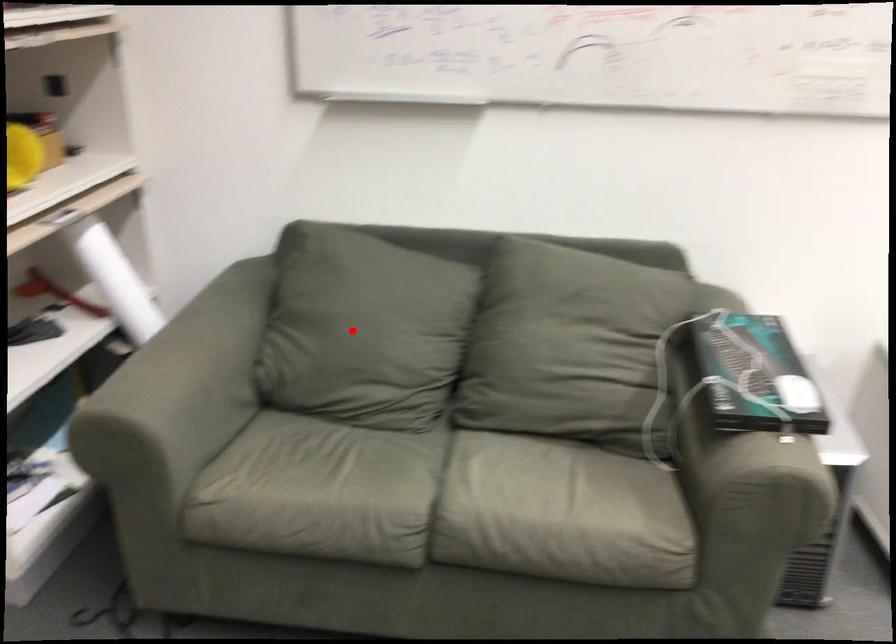
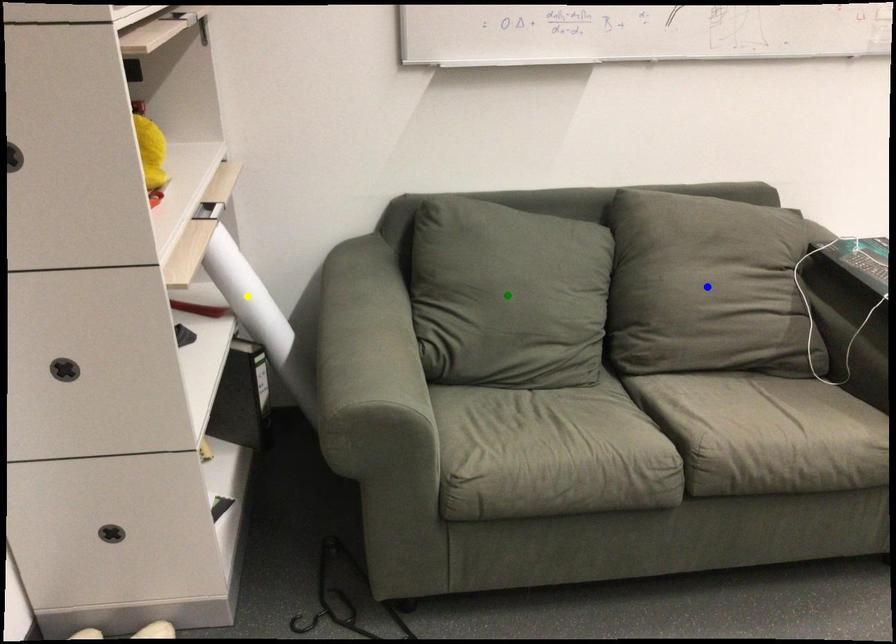
Question: I am providing you with two images of the same scene from different viewpoints. A red point is marked on the first image. You are given multiple points on the second image. Which point in image 2 represents the same 3d spot as the red point in image 1?

Choices:
 (A) yellow point
 (B) blue point
 (C) green point

Answer: (C)